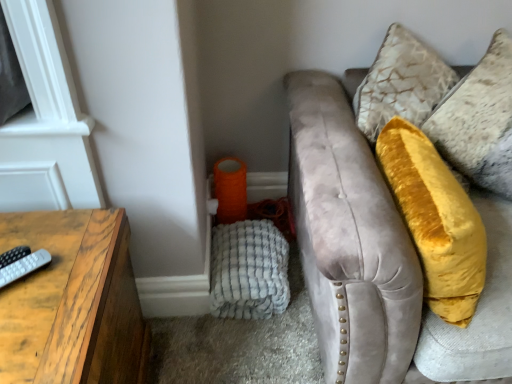
Find the location of a particular element. free space to the right of gray matte remote at left is located at coordinates (65, 295).